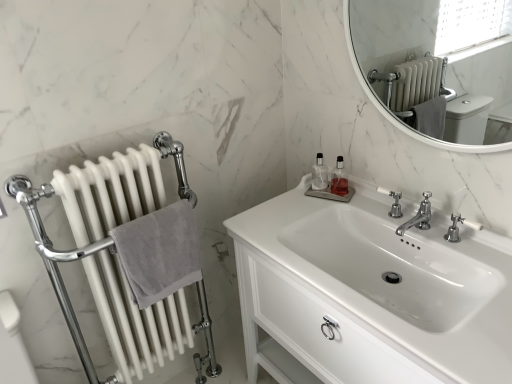
Question: In the image, is clear glass bottle at upper center, marked as the first toiletry in a left-to-right arrangement, positioned in front of or behind polished chrome faucet at upper right?

Choices:
 (A) front
 (B) behind

Answer: (B)

Question: Considering the positions of point (317, 183) and point (395, 196), is point (317, 183) closer or farther from the camera than point (395, 196)?

Choices:
 (A) closer
 (B) farther

Answer: (B)

Question: Which object is positioned closest to the gray cotton towel at left?

Choices:
 (A) polished chrome faucet at center, the 2th tap when ordered from right to left
 (B) clear glass bottle at upper center, arranged as the 2th toiletry when viewed from the right
 (C) polished chrome faucet at upper right
 (D) white marble mirror at upper right
 (E) clear glass bottle at upper center, which is counted as the second toiletry, starting from the left

Answer: (B)

Question: Based on their relative distances, which object is farther from the gray cotton towel at left?

Choices:
 (A) polished chrome faucet at center, the 2th tap when ordered from right to left
 (B) white marble mirror at upper right
 (C) polished chrome faucet at right, acting as the first tap starting from the right
 (D) white matte radiator at left
 (E) white glossy sink at center

Answer: (B)